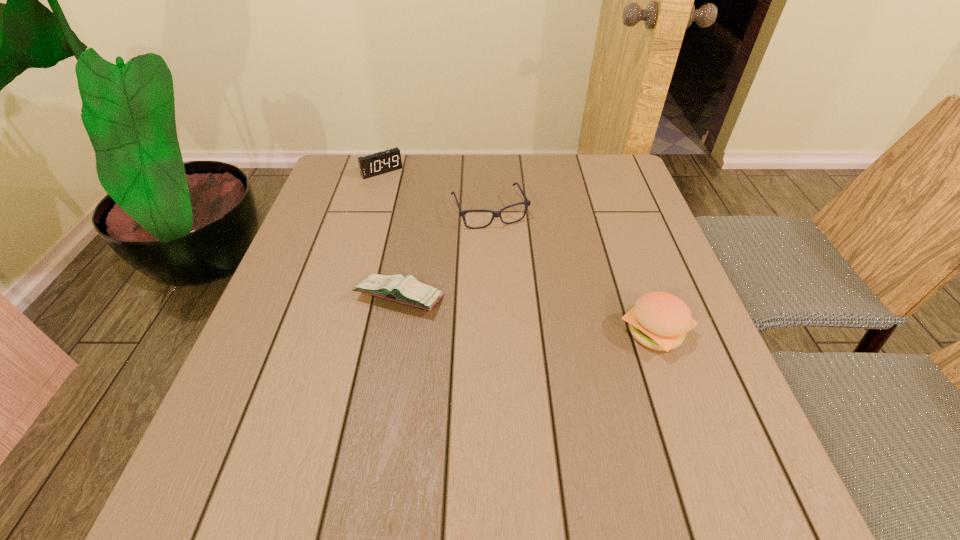
Identify the location of empty space between the second farthest object and the alarm clock. The image size is (960, 540). (436, 191).

Locate an element on the screen. The width and height of the screenshot is (960, 540). vacant area that lies between the rightmost object and the diary is located at coordinates (527, 315).

Where is `vacant space that is in between the hamburger and the diary`? The width and height of the screenshot is (960, 540). vacant space that is in between the hamburger and the diary is located at coordinates click(x=527, y=315).

This screenshot has width=960, height=540. Identify the location of vacant space that's between the diary and the farthest object. (391, 234).

At what (x,y) coordinates should I click in order to perform the action: click on free space between the diary and the alarm clock. Please return your answer as a coordinate pair (x, y). Looking at the image, I should click on (391, 234).

Identify which object is located as the second nearest to the spectacles. Please provide its 2D coordinates. Your answer should be formatted as a tuple, i.e. [(x, y)], where the tuple contains the x and y coordinates of a point satisfying the conditions above.

[(371, 165)]

The width and height of the screenshot is (960, 540). I want to click on object that is the closest to the farthest object, so tap(527, 203).

Find the location of a particular element. This screenshot has width=960, height=540. free space that satisfies the following two spatial constraints: 1. on the back side of the second farthest object; 2. on the left side of the diary is located at coordinates (415, 211).

You are a GUI agent. You are given a task and a screenshot of the screen. Output one action in this format:
    pyautogui.click(x=<x>, y=<y>)
    Task: Click on the vacant space that satisfies the following two spatial constraints: 1. on the front side of the rightmost object; 2. on the right side of the third nearest object
    This screenshot has height=540, width=960.
    Given the screenshot: What is the action you would take?
    pyautogui.click(x=492, y=332)